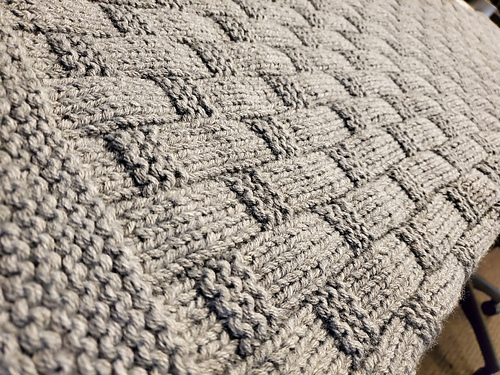
I want to click on edge of the rug, so click(454, 304).